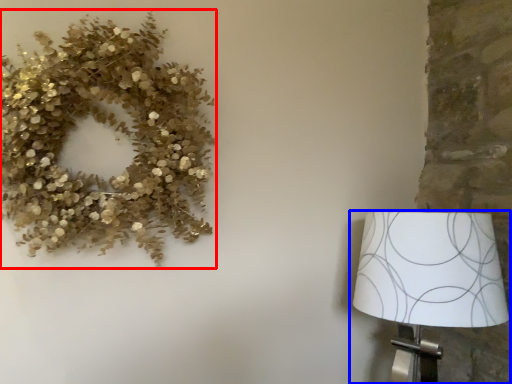
Question: Which object appears closest to the camera in this image, floral arrangement (highlighted by a red box) or lamp (highlighted by a blue box)?

Choices:
 (A) floral arrangement
 (B) lamp

Answer: (A)